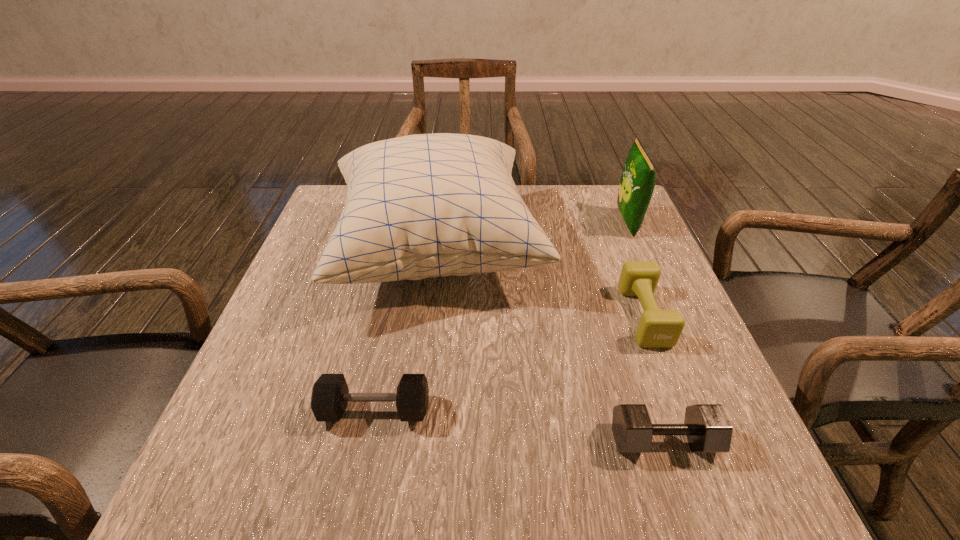
You are a GUI agent. You are given a task and a screenshot of the screen. Output one action in this format:
    pyautogui.click(x=<x>, y=<y>)
    Task: Click on the cushion at the far edge
    The width and height of the screenshot is (960, 540).
    Given the screenshot: What is the action you would take?
    pyautogui.click(x=418, y=206)

The image size is (960, 540). Identify the location of crisp (potato chip) situated at the far edge. (637, 183).

The height and width of the screenshot is (540, 960). In order to click on object at the near edge in this screenshot , I will do `click(707, 428)`.

Identify the location of cushion present at the left edge. (418, 206).

I want to click on dumbbell that is positioned at the left edge, so click(x=330, y=394).

I want to click on crisp (potato chip) present at the right edge, so click(637, 183).

The width and height of the screenshot is (960, 540). I want to click on object located at the far left corner, so click(418, 206).

Find the location of a particular element. This screenshot has width=960, height=540. object that is at the far right corner is located at coordinates (637, 183).

Locate an element on the screen. object that is at the near right corner is located at coordinates (707, 428).

Locate an element on the screen. vacant space at the near edge of the desktop is located at coordinates (624, 482).